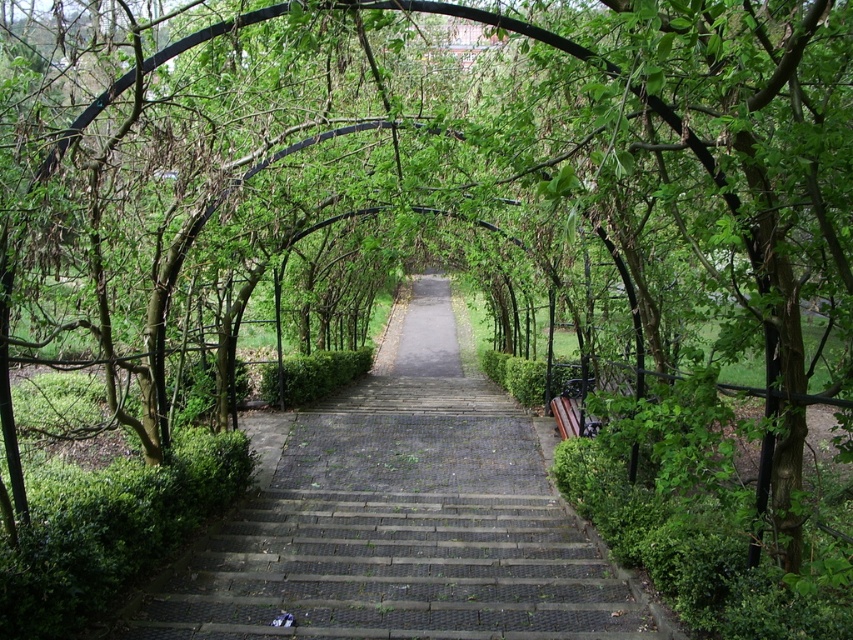
You are a gardener who needs to move a heavy potted plant from the wooden bench at right to the dark gray cobblestone stairs at center. Considering the path between them, can you determine if the stairs are positioned higher or lower than the bench?

The dark gray cobblestone stairs at center is located above the wooden bench at right, so the stairs are positioned higher than the bench.

Based on the photo, you are a gardener who needs to move a large potted plant from the garden to the house. The potted plant is currently placed on the wooden bench at right. You want to transport it up the dark gray cobblestone stairs at center. Considering the space available, can the potted plant fit through the area between the stairs and the hedges?

The dark gray cobblestone stairs at center might be wider than wooden bench at right, so the potted plant may fit through the area between the stairs and the hedges if the width is sufficient. However, the exact dimensions are uncertain based on the provided information.

From the picture: You are planning to place a small potted plant between the dark gray cobblestone stairs at center and the wooden bench at right. Considering their sizes, which object should the plant be closer to?

The dark gray cobblestone stairs at center is larger than the wooden bench at right, so the plant should be placed closer to the wooden bench at right to maintain balance.